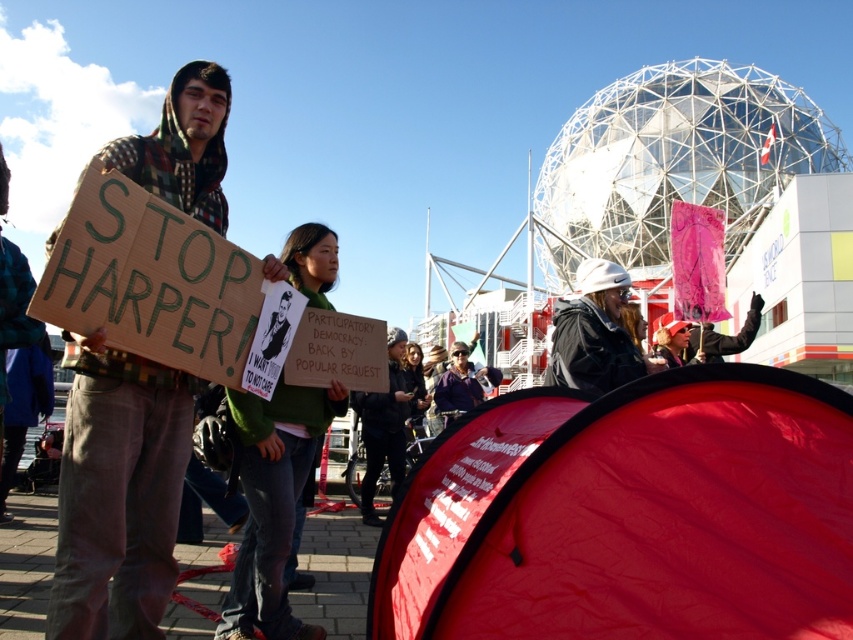
Is the position of red fabric tent at lower right less distant than that of green fabric shirt at center?

Yes.

Identify the location of red fabric tent at lower right. (630, 515).

I want to click on red fabric tent at lower right, so click(630, 515).

Can you confirm if plaid fabric hoodie at left is taller than white matte helmet at upper center?

Correct, plaid fabric hoodie at left is much taller as white matte helmet at upper center.

Does plaid fabric hoodie at left lie behind white matte helmet at upper center?

No, plaid fabric hoodie at left is in front of white matte helmet at upper center.

Which is behind, point (221, 86) or point (592, 374)?

Point (592, 374)

I want to click on plaid fabric hoodie at left, so click(119, 493).

Consider the image. Who is taller, red fabric tent at lower right or white matte helmet at upper center?

Standing taller between the two is red fabric tent at lower right.

Is red fabric tent at lower right below white matte helmet at upper center?

Yes.

This screenshot has width=853, height=640. I want to click on red fabric tent at lower right, so pos(630,515).